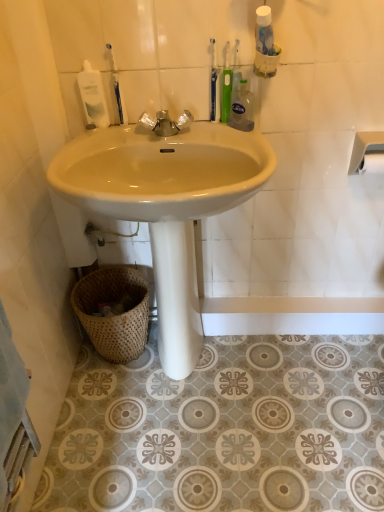
What are the coordinates of `free spot in front of blue plastic toothbrush at upper center, which is the second toothbrush from left to right` in the screenshot? It's located at (224, 137).